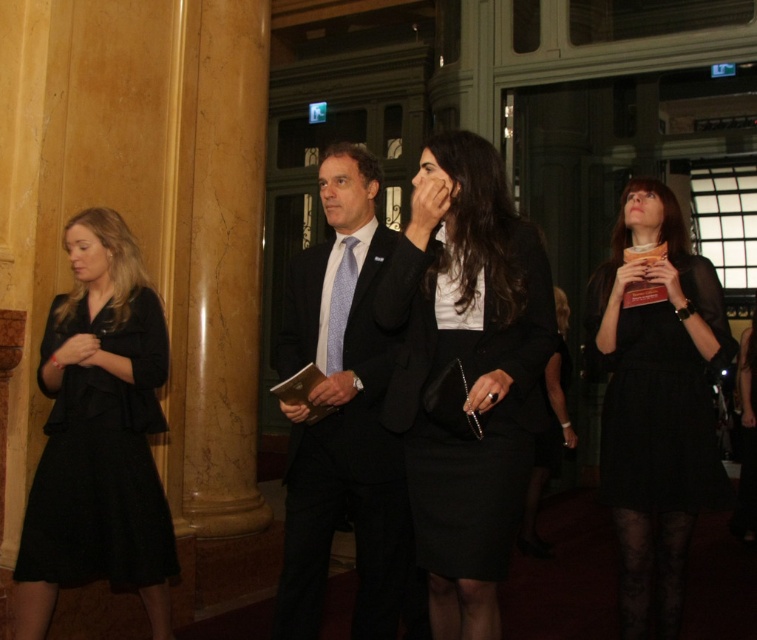
Can you confirm if matte black suit at center is positioned above black satin dress at right?

Correct, matte black suit at center is located above black satin dress at right.

Who is positioned more to the right, matte black suit at center or black satin dress at right?

From the viewer's perspective, black satin dress at right appears more on the right side.

I want to click on matte black suit at center, so click(x=343, y=419).

Identify the location of matte black suit at center. This screenshot has height=640, width=757. (343, 419).

Which is in front, point (640, 356) or point (343, 307)?

Positioned in front is point (343, 307).

Does black satin dress at right appear on the left side of light blue textured tie at center?

Incorrect, black satin dress at right is not on the left side of light blue textured tie at center.

Between point (643, 465) and point (332, 289), which one is positioned in front?

Point (332, 289) is more forward.

Where is `black satin dress at right`? black satin dress at right is located at coordinates (656, 397).

Is black matte dress at left wider than light blue textured tie at center?

Indeed, black matte dress at left has a greater width compared to light blue textured tie at center.

Between point (67, 493) and point (346, 276), which one is positioned behind?

The point (67, 493) is behind.

This screenshot has height=640, width=757. I want to click on black matte dress at left, so click(101, 460).